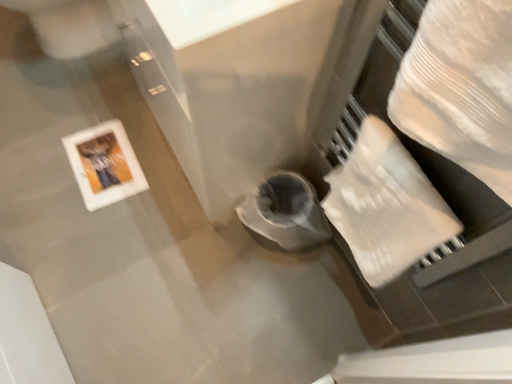
The width and height of the screenshot is (512, 384). In order to click on free region on the left part of white glossy picture frame at upper left in this screenshot , I will do `click(36, 158)`.